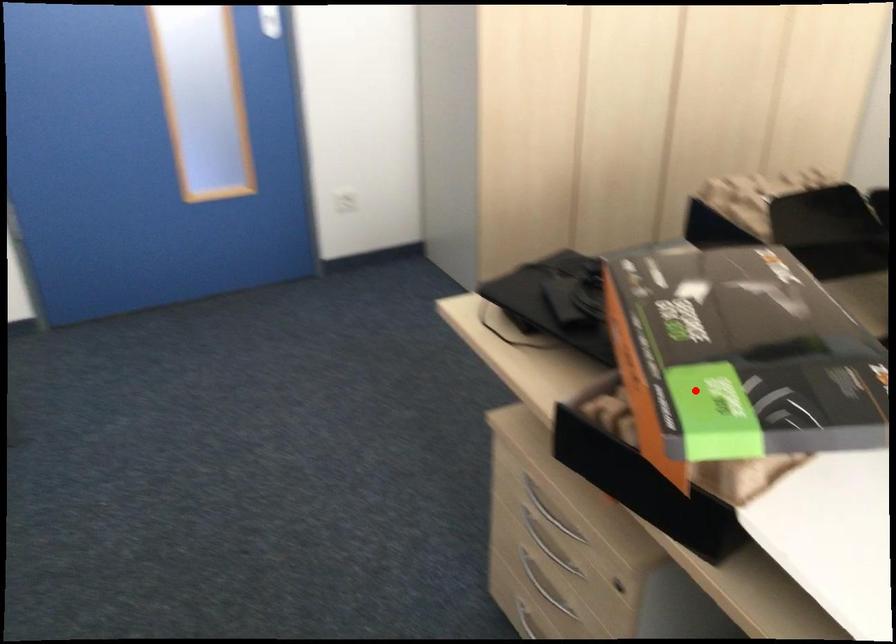
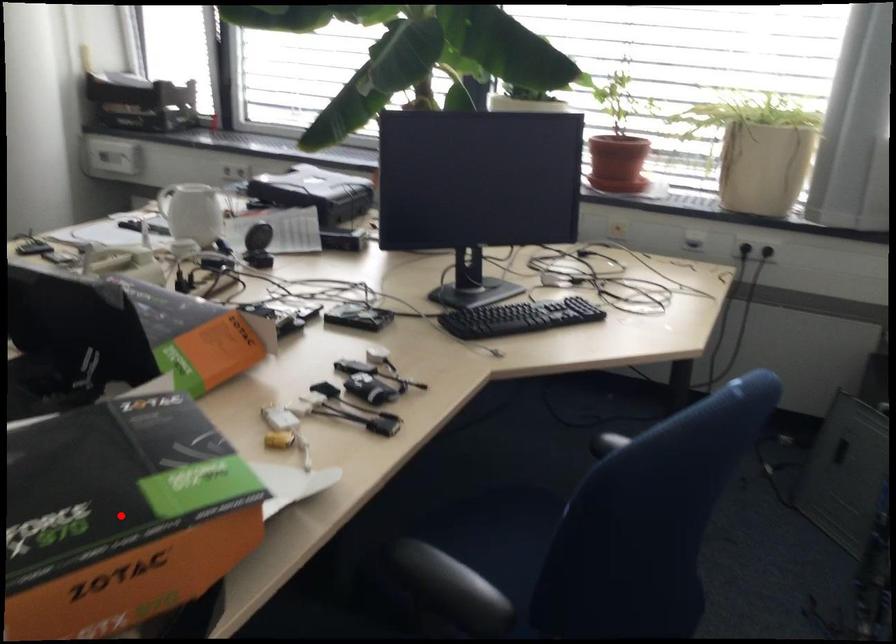
I am providing you with two images of the same scene from different viewpoints. A red point is marked on the first image and another point is marked on the second image. Do the highlighted points in image1 and image2 indicate the same real-world spot?

Yes